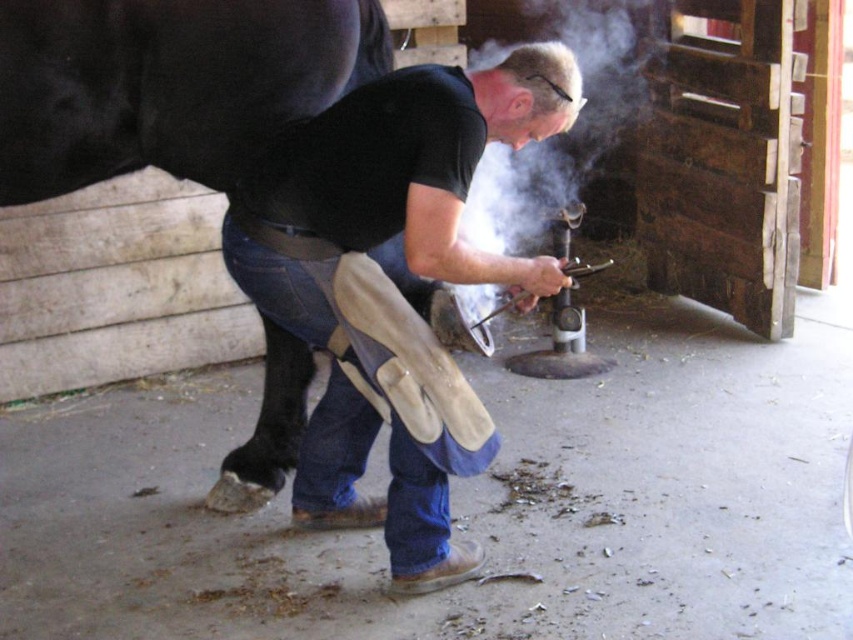
You are a safety inspector checking the workspace of the man shoeing the horse. The leather gloves at center and blue denim jeans at center are part of his protective gear. According to safety regulations, the minimum distance between these two items should be at least 10 inches to prevent entanglement. Is the current setup compliant?

The leather gloves at center is 7.68 inches away from blue denim jeans at center. Since this distance is less than the required 10 inches, the setup does not comply with safety regulations to prevent entanglement.

You are a visitor in the barn and want to know where the leather gloves at center are located relative to the blue denim jeans at center. Can you tell me their positions?

The leather gloves at center are to the right of the blue denim jeans at center.

You are a worker in the barn and need to locate your leather gloves at center. According to the coordinates provided, where should you look to find them?

The leather gloves at center are located at coordinates point (393, 284).